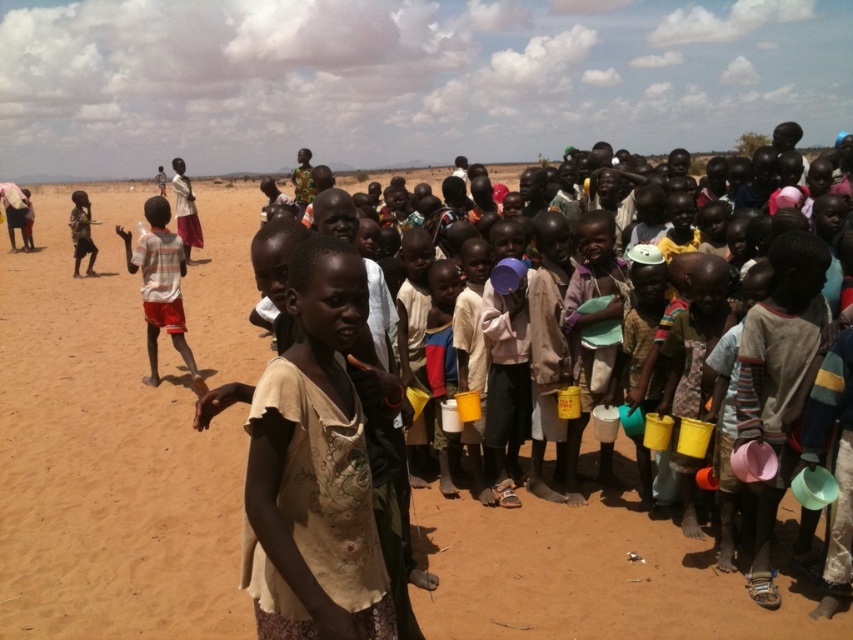
You are a photographer standing in the desert scene. You want to take a photo that includes both the point at coordinates point (x=165, y=262) and point (x=79, y=252). Which point should you focus on to ensure both are in sharp focus?

You should focus on point (x=79, y=252) because it is farther from the camera than point (x=165, y=262). By focusing on the farther point, the depth of field will include the closer point as well, ensuring both are in sharp focus.

From the picture: You are a photographer standing at the center of the scene. You want to take a photo of the striped cotton shirt at left. Where should you aim your camera to capture it in the frame?

You should aim your camera at point 0.447 on the x axis and 0.189 on the y axis to capture the striped cotton shirt at left in the frame.

You are a photographer trying to capture a photo of the striped cotton shirt at left and the dark skin child at left. Which object should you focus on first if you want to ensure both are in focus without moving the camera?

The striped cotton shirt at left is positioned under the dark skin child at left, so you should focus on the dark skin child at left first since it is closer to the camera. This way, the shirt will also be in focus as it is behind the child.